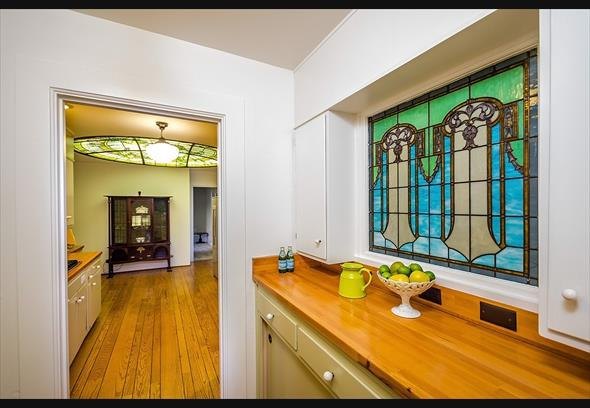
I want to click on cup, so click(360, 283).